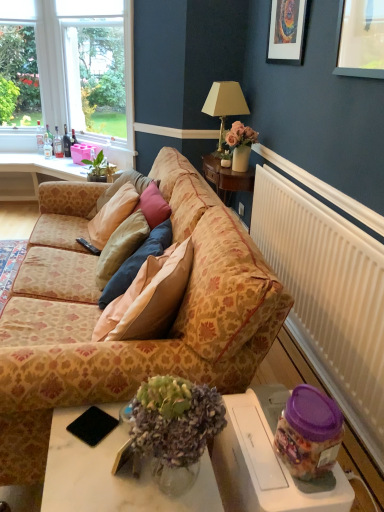
What do you see at coordinates (224, 106) in the screenshot?
I see `beige fabric lampshade at upper right` at bounding box center [224, 106].

At what (x,y) coordinates should I click in order to perform the action: click on clear glass window at upper left. Please return your answer as a coordinate pair (x, y). Looking at the image, I should click on (72, 70).

The width and height of the screenshot is (384, 512). What do you see at coordinates (98, 168) in the screenshot?
I see `green leafy plant at upper left` at bounding box center [98, 168].

Where is `purple plastic jar at lower right`? The height and width of the screenshot is (512, 384). purple plastic jar at lower right is located at coordinates (267, 465).

How far apart are patterned fabric couch at center and black matte pad at lower left?

A distance of 25.87 inches exists between patterned fabric couch at center and black matte pad at lower left.

Which is more to the left, patterned fabric couch at center or black matte pad at lower left?

patterned fabric couch at center is more to the left.

Consider the image. Is patterned fabric couch at center far away from black matte pad at lower left?

No, patterned fabric couch at center is not far from black matte pad at lower left.

Where is `pad positioned vertically above the patterned fabric couch at center (from a real-world perspective)`? pad positioned vertically above the patterned fabric couch at center (from a real-world perspective) is located at coordinates [92, 426].

Is black plastic remote control at center completely or partially outside of matte black picture frame at upper center?

Yes, black plastic remote control at center is not within matte black picture frame at upper center.

Is black plastic remote control at center in front of or behind matte black picture frame at upper center in the image?

In the image, black plastic remote control at center appears behind matte black picture frame at upper center.

Looking at the image, does clear glass bottle at left, acting as the 2th bottle starting from the right, seem bigger or smaller compared to beige fabric lampshade at upper right?

Considering their sizes, clear glass bottle at left, acting as the 2th bottle starting from the right, takes up less space than beige fabric lampshade at upper right.

From the image's perspective, which is above, clear glass bottle at left, the 3th bottle viewed from the left, or beige fabric lampshade at upper right?

From the image's view, clear glass bottle at left, the 3th bottle viewed from the left, is above.

The width and height of the screenshot is (384, 512). Find the location of `lamp located below the clear glass bottle at left, the 3th bottle viewed from the left (from the image's perspective)`. lamp located below the clear glass bottle at left, the 3th bottle viewed from the left (from the image's perspective) is located at coordinates (224, 106).

Consider the image. Considering the relative positions of clear glass bottle at left, the 3th bottle viewed from the left, and beige fabric lampshade at upper right in the image provided, is clear glass bottle at left, the 3th bottle viewed from the left, in front of beige fabric lampshade at upper right?

No, clear glass bottle at left, the 3th bottle viewed from the left, is further to the viewer.

Between white textured radiator at right and matte black picture frame at upper center, which one has smaller size?

matte black picture frame at upper center.

Considering the relative sizes of white textured radiator at right and matte black picture frame at upper center in the image provided, is white textured radiator at right wider than matte black picture frame at upper center?

Yes, white textured radiator at right is wider than matte black picture frame at upper center.

Which is behind, point (361, 412) or point (278, 36)?

Point (278, 36)

Starting from the black matte pad at lower left, which bottle is the 2nd one behind? Please provide its 2D coordinates.

[(66, 143)]

Looking at this image, from a real-world perspective, is black matte pad at lower left positioned above or below matte glass bottle at center, the first bottle viewed from the right?

Clearly, from a real-world perspective, black matte pad at lower left is below matte glass bottle at center, the first bottle viewed from the right.

Which is closer, (95, 417) or (68, 149)?

Clearly, point (95, 417) is closer to the camera than point (68, 149).

Is patterned fabric couch at center taller or shorter than clear glass bottle at upper left, arranged as the first bottle when viewed from the left?

Clearly, patterned fabric couch at center is taller compared to clear glass bottle at upper left, arranged as the first bottle when viewed from the left.

Could you measure the distance between patterned fabric couch at center and clear glass bottle at upper left, the 4th bottle viewed from the right?

They are 10.31 feet apart.

There is a patterned fabric couch at center. Identify the location of the 4th bottle above it (from the image's perspective). (40, 137).

Does point (252, 485) come closer to viewer compared to point (48, 137)?

That is True.

How many degrees apart are the facing directions of white marble table at lower center and clear glass bottle at left, marked as the second bottle in a left-to-right arrangement?

91.7 degrees separate the facing orientations of white marble table at lower center and clear glass bottle at left, marked as the second bottle in a left-to-right arrangement.

Is white marble table at lower center turned away from clear glass bottle at left, marked as the second bottle in a left-to-right arrangement?

Answer: No.

Where is `studio couch directly beneath the black matte pad at lower left (from a real-world perspective)`? This screenshot has width=384, height=512. studio couch directly beneath the black matte pad at lower left (from a real-world perspective) is located at coordinates (133, 336).

Image resolution: width=384 pixels, height=512 pixels. Identify the location of picture frame in front of the black plastic remote control at center. (286, 31).

Looking at the image, which one is located closer to black plastic remote control at center, matte black picture frame at upper center or white marble table at lower center?

white marble table at lower center lies closer to black plastic remote control at center than the other object.

Estimate the real-world distances between objects in this image. Which object is further from black matte pad at lower left, clear glass bottle at left, the 3th bottle viewed from the left, or patterned fabric couch at center?

Among the two, clear glass bottle at left, the 3th bottle viewed from the left, is located further to black matte pad at lower left.

Based on their spatial positions, is green leafy plant at upper left or purple plastic jar at lower right closer to white glossy desk at upper left?

green leafy plant at upper left.

Considering their positions, is clear glass bottle at left, marked as the second bottle in a left-to-right arrangement, positioned further to black matte pad at lower left than clear glass bottle at upper left, the 4th bottle viewed from the right?

Based on the image, clear glass bottle at upper left, the 4th bottle viewed from the right, appears to be further to black matte pad at lower left.

Which object lies further to the anchor point patterned fabric couch at center, matte black picture frame at upper center or white marble table at lower center?

Based on the image, matte black picture frame at upper center appears to be further to patterned fabric couch at center.

Based on their spatial positions, is matte glass bottle at center, the first bottle viewed from the right, or clear glass bottle at upper left, arranged as the first bottle when viewed from the left, further from black plastic remote control at center?

Based on the image, clear glass bottle at upper left, arranged as the first bottle when viewed from the left, appears to be further to black plastic remote control at center.

Which object lies nearer to the anchor point matte glass bottle at center, placed as the 4th bottle when sorted from left to right, clear glass window at upper left or black matte pad at lower left?

clear glass window at upper left lies closer to matte glass bottle at center, placed as the 4th bottle when sorted from left to right, than the other object.

From the image, which object appears to be nearer to purple plastic jar at lower right, clear glass window at upper left or white textured radiator at right?

white textured radiator at right is closer to purple plastic jar at lower right.

Where is `desk between clear glass window at upper left and clear glass bottle at left, marked as the second bottle in a left-to-right arrangement, in the front-back direction`? desk between clear glass window at upper left and clear glass bottle at left, marked as the second bottle in a left-to-right arrangement, in the front-back direction is located at coordinates (33, 174).

What are the coordinates of `houseplant located between matte black picture frame at upper center and clear glass bottle at left, the 3th bottle viewed from the left, in the depth direction` in the screenshot? It's located at (98, 168).

This screenshot has width=384, height=512. I want to click on houseplant located between white textured radiator at right and clear glass bottle at left, marked as the second bottle in a left-to-right arrangement, in the depth direction, so click(x=98, y=168).

You are a GUI agent. You are given a task and a screenshot of the screen. Output one action in this format:
    pyautogui.click(x=<x>, y=<y>)
    Task: Click on the window between white textured radiator at right and clear glass bottle at left, the 3th bottle viewed from the left, in the front-back direction
    The image size is (384, 512).
    Given the screenshot: What is the action you would take?
    pyautogui.click(x=72, y=70)